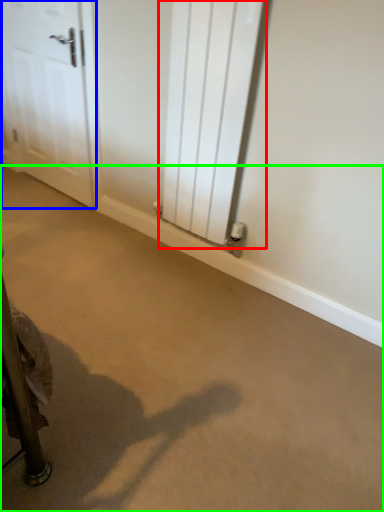
Question: Which object is the farthest from radiator (highlighted by a red box)? Choose among these: door (highlighted by a blue box) or concrete (highlighted by a green box).

Choices:
 (A) door
 (B) concrete

Answer: (A)